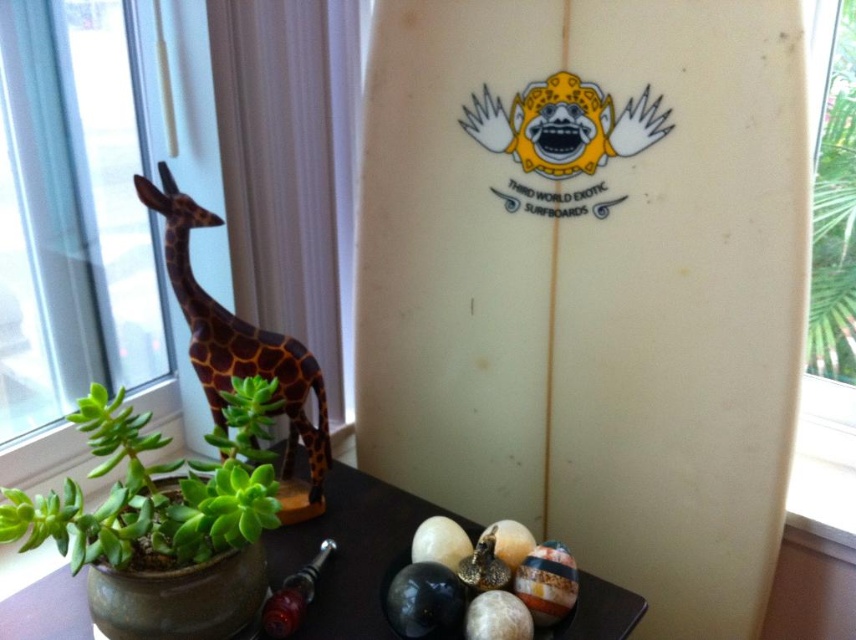
You are holding a camera and want to take a photo of the white matte surfboard at center. If you are standing 31.48 inches away from it, is that the recommended distance for a clear shot? Please explain based on the scene description.

The white matte surfboard at center and camera are 31.48 inches apart from each other. This distance is suitable for capturing a clear and detailed photo of the surfboard as it allows the camera to focus effectively without being too close or too far.

You are standing in front of the surfboard and want to place a small gift on the nearest object between the green succulent at lower left and the brown wooden giraffe at left. Which object should you choose?

The green succulent at lower left is closer to the viewer than the brown wooden giraffe at left, so you should place the gift on the green succulent at lower left.

You are standing in the room and want to place a new decorative item on the table in front of the surfboard. The coordinates given are in the image coordinate system where the origin is at the bottom left corner. The table is located at the bottom of the image. Can you place the item at point (591, 282)?

Result: The point (591, 282) marks the white matte surfboard at center, so placing an item there would actually place it on the surfboard, not the table. The table is located at the bottom of the image, so you should choose coordinates closer to the bottom edge.